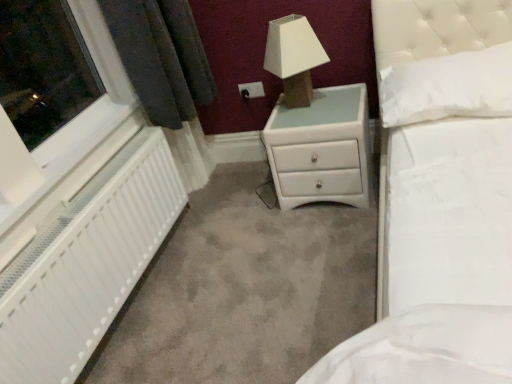
Locate an element on the screen. This screenshot has height=384, width=512. vacant space situated above white plastic window at left (from a real-world perspective) is located at coordinates (70, 137).